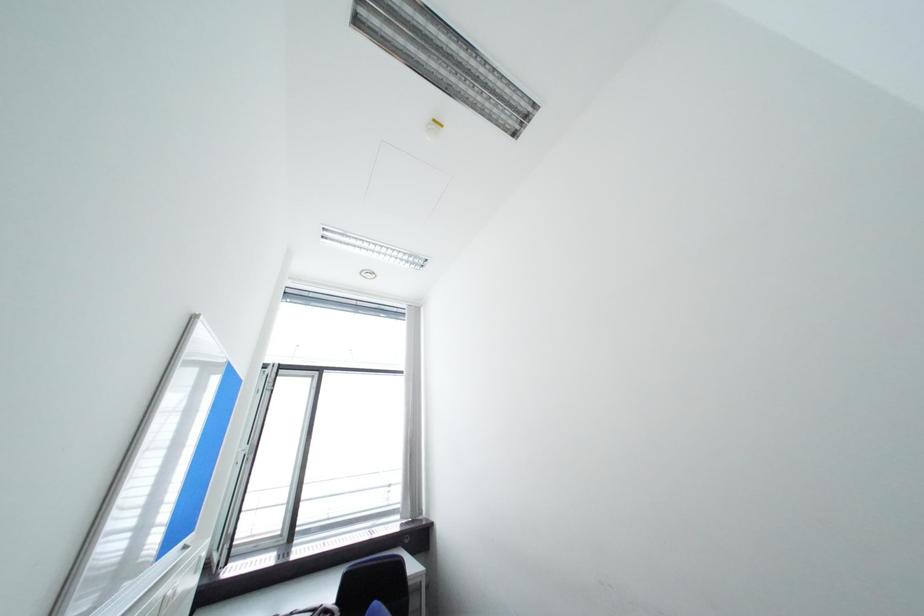
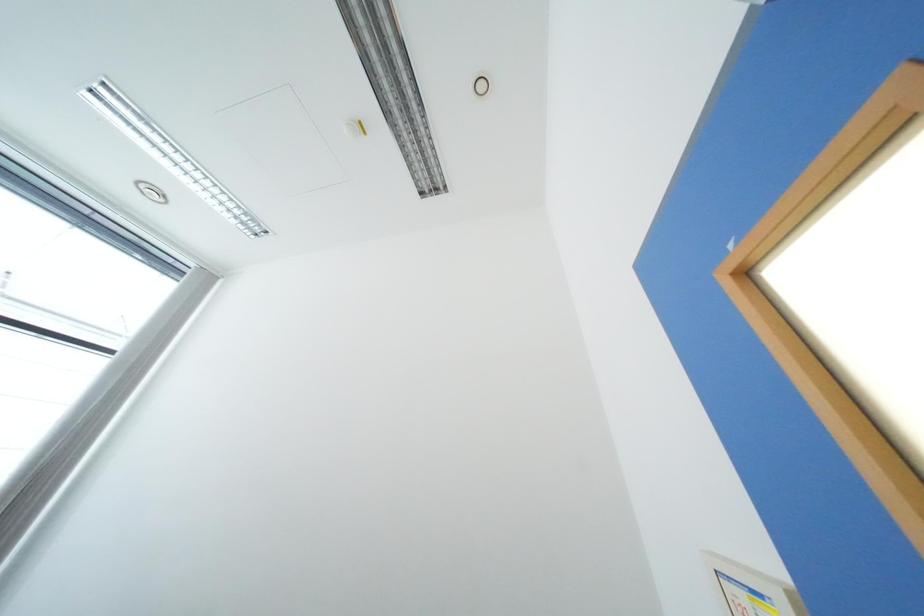
The images are taken continuously from a first-person perspective. In which direction is your viewpoint rotating?

The rotation direction of the camera is right-up.